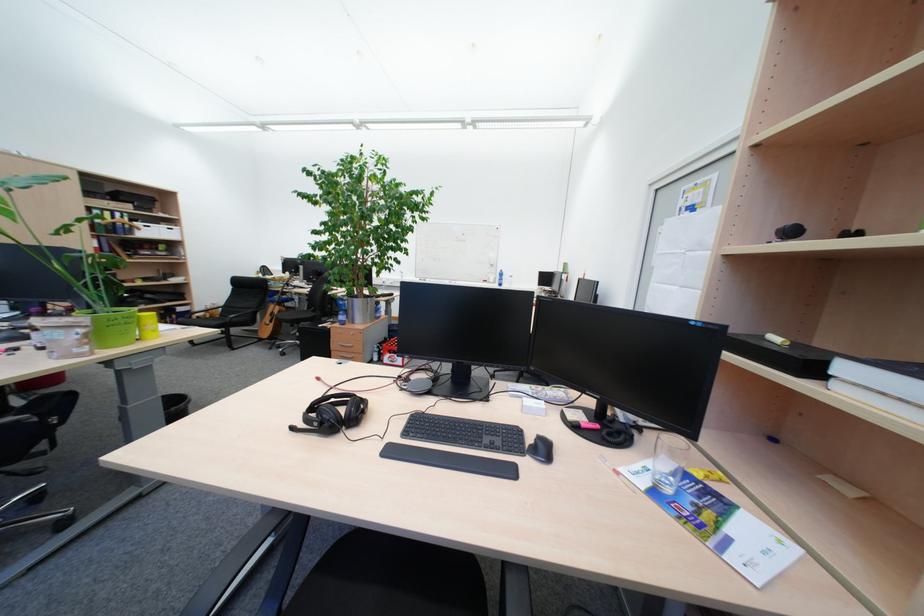
Image resolution: width=924 pixels, height=616 pixels. What do you see at coordinates (344, 345) in the screenshot? I see `the silver drawer handle` at bounding box center [344, 345].